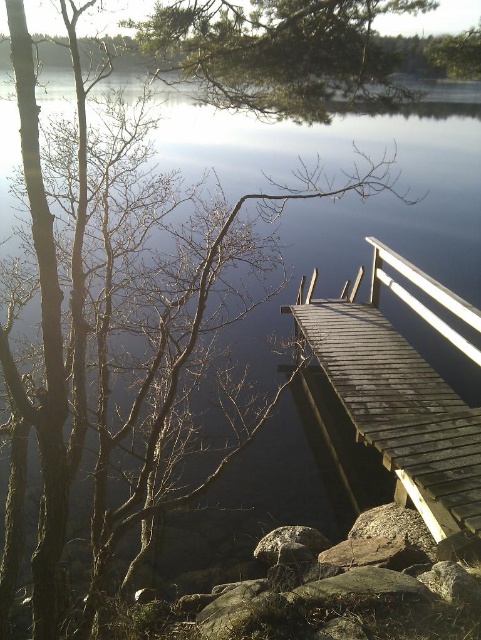
You are standing at the lakeside and want to take a photo of both point (253, 42) and point (370, 243) in the scene. Since you want both points to be clearly visible in the photo, which point should you focus on to ensure sharpness?

You should focus on point (253, 42) because it is closer to the camera than point (370, 243). Focusing on the closer point will ensure that both points are within the depth of field and appear sharp in the photo.

You are standing on the lakeside path and see the dark brown wooden dock at right and the white glossy rail at upper right. Which object is positioned higher from the ground?

The white glossy rail at upper right is positioned higher from the ground than the dark brown wooden dock at right.

You are a painter setting up your easel to capture the serene lakeside scene. You want to ensure the dark brown wooden dock at right and the white glossy rail at upper right are proportionally accurate in your painting. Which object should you make larger in your artwork?

The dark brown wooden dock at right should be made larger in your artwork since it is larger in size than the white glossy rail at upper right according to the description.